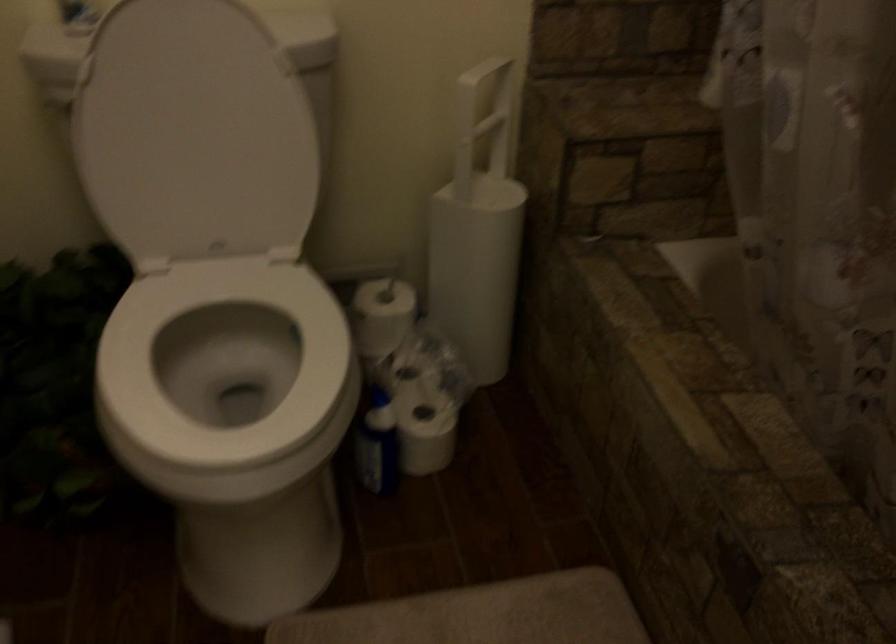
Where would you push the white toilet lid? Please return your answer as a coordinate pair (x, y).

(194, 134)